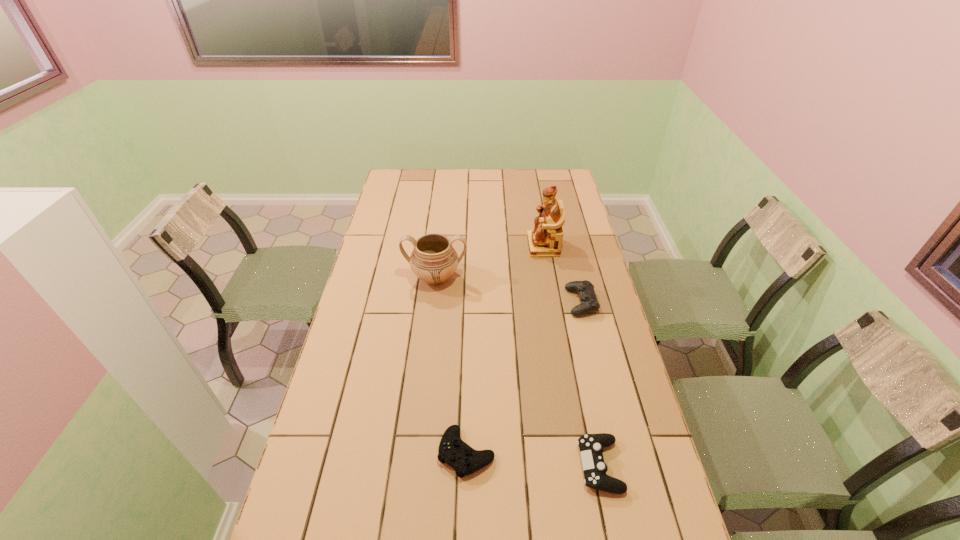
This screenshot has width=960, height=540. In order to click on free point between the fourth shortest object and the shortest object in this screenshot , I will do `click(451, 365)`.

I want to click on unoccupied area between the figurine and the shortest object, so click(x=505, y=349).

Identify the location of free point between the farthest object and the shortest object. This screenshot has height=540, width=960. (505, 349).

At what (x,y) coordinates should I click in order to perform the action: click on free space that is in between the farthest control and the leftmost control. Please return your answer as a coordinate pair (x, y). This screenshot has height=540, width=960. Looking at the image, I should click on (524, 377).

Identify the location of object that is the third closest to the leftmost control. The height and width of the screenshot is (540, 960). (434, 260).

Locate an element on the screen. The image size is (960, 540). object identified as the closest to the shortest object is located at coordinates (591, 446).

Choose which control is the third nearest neighbor to the tallest object. Please provide its 2D coordinates. Your answer should be formatted as a tuple, i.e. [(x, y)], where the tuple contains the x and y coordinates of a point satisfying the conditions above.

[(591, 446)]

Locate an element on the screen. the third closest control relative to the figurine is located at coordinates (591, 446).

At what (x,y) coordinates should I click in order to perform the action: click on vacant space that satisfies the following two spatial constraints: 1. on the front-facing side of the tallest object; 2. on the left side of the farthest control. Please return your answer as a coordinate pair (x, y). Image resolution: width=960 pixels, height=540 pixels. Looking at the image, I should click on (553, 302).

The height and width of the screenshot is (540, 960). I want to click on free space that satisfies the following two spatial constraints: 1. on the front-facing side of the tallest object; 2. on the front-facing side of the urn, so click(x=548, y=278).